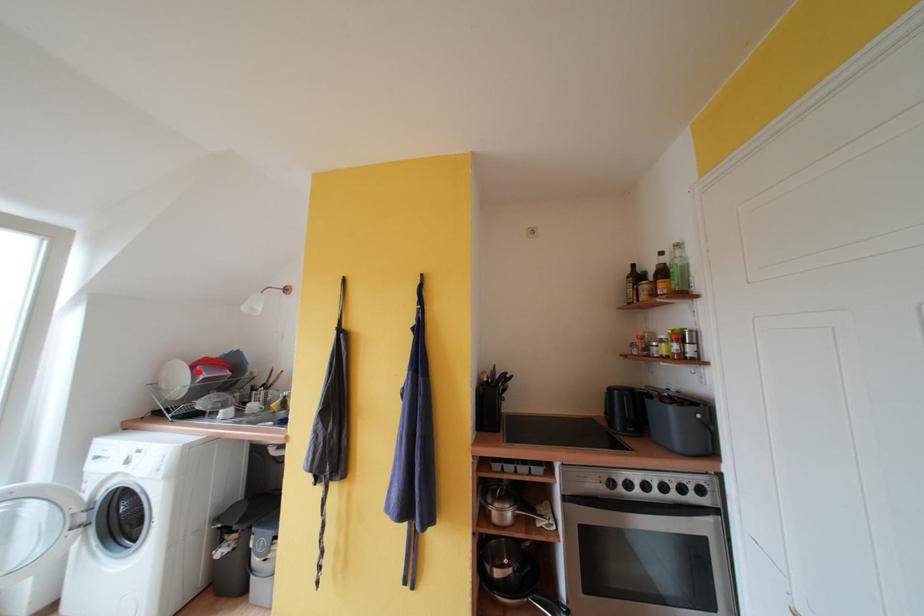
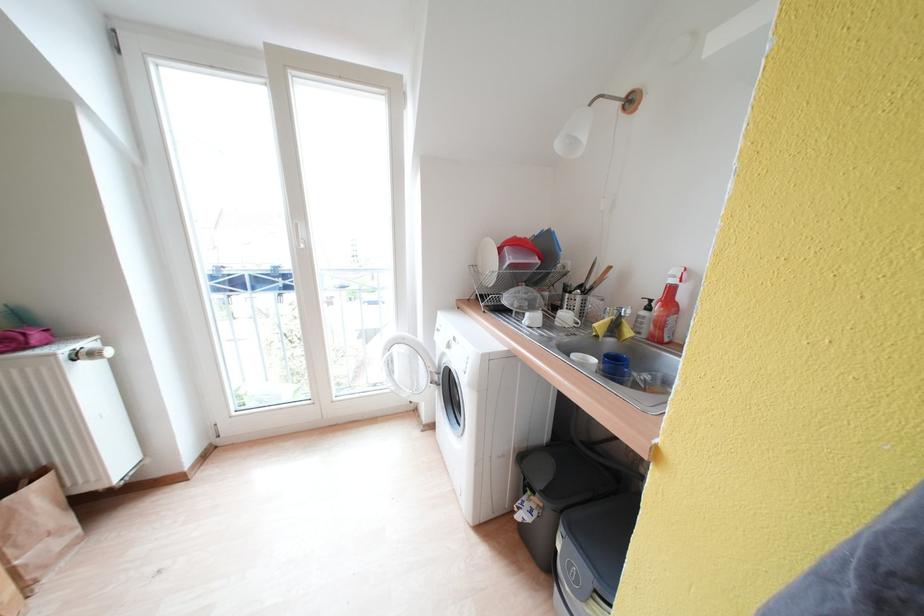
Find the pixel in the second image that matches the highlighted location in the first image.

(505, 254)